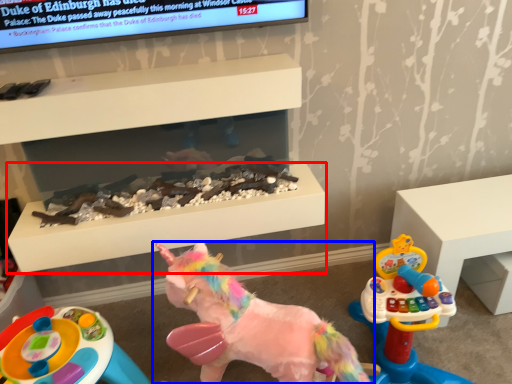
Question: Which object is further to the camera taking this photo, table (highlighted by a red box) or toy (highlighted by a blue box)?

Choices:
 (A) table
 (B) toy

Answer: (A)